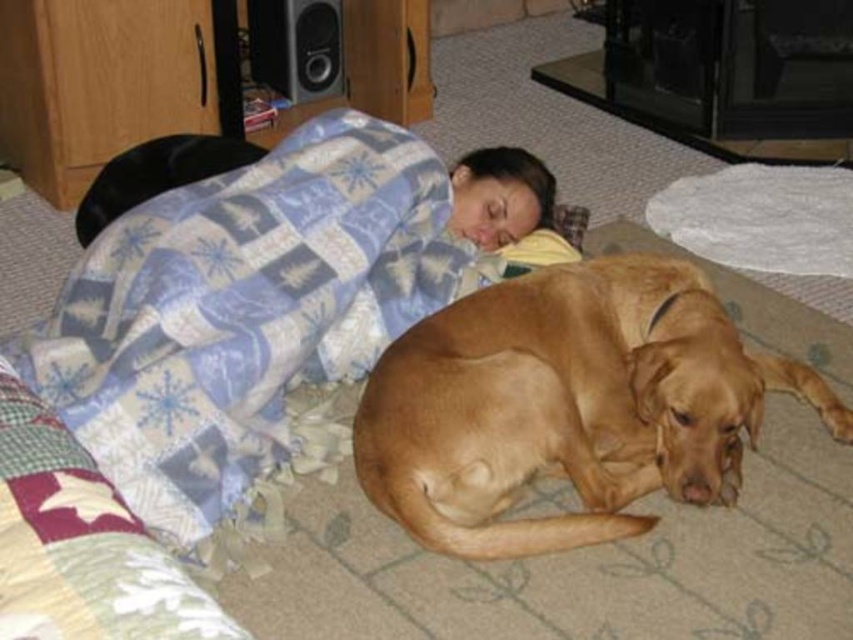
Is golden fur dog at lower right in front of metallic silver speaker at upper left?

Yes, it is in front of metallic silver speaker at upper left.

Is golden fur dog at lower right taller than metallic silver speaker at upper left?

Indeed, golden fur dog at lower right has a greater height compared to metallic silver speaker at upper left.

The width and height of the screenshot is (853, 640). I want to click on golden fur dog at lower right, so click(x=567, y=404).

Identify the location of golden fur dog at lower right. The width and height of the screenshot is (853, 640). tap(567, 404).

Which of these two, blue plaid blanket at upper center or metallic silver speaker at upper left, stands shorter?

metallic silver speaker at upper left is shorter.

From the picture: Is blue plaid blanket at upper center positioned at the back of metallic silver speaker at upper left?

No, it is not.

Which is in front, point (241, 177) or point (314, 10)?

Point (241, 177) is in front.

Locate an element on the screen. The height and width of the screenshot is (640, 853). blue plaid blanket at upper center is located at coordinates (242, 310).

Is blue plaid blanket at upper center thinner than golden fur dog at lower right?

No, blue plaid blanket at upper center is not thinner than golden fur dog at lower right.

Can you confirm if blue plaid blanket at upper center is positioned to the right of golden fur dog at lower right?

Incorrect, blue plaid blanket at upper center is not on the right side of golden fur dog at lower right.

What do you see at coordinates (242, 310) in the screenshot?
I see `blue plaid blanket at upper center` at bounding box center [242, 310].

Locate an element on the screen. The height and width of the screenshot is (640, 853). blue plaid blanket at upper center is located at coordinates (242, 310).